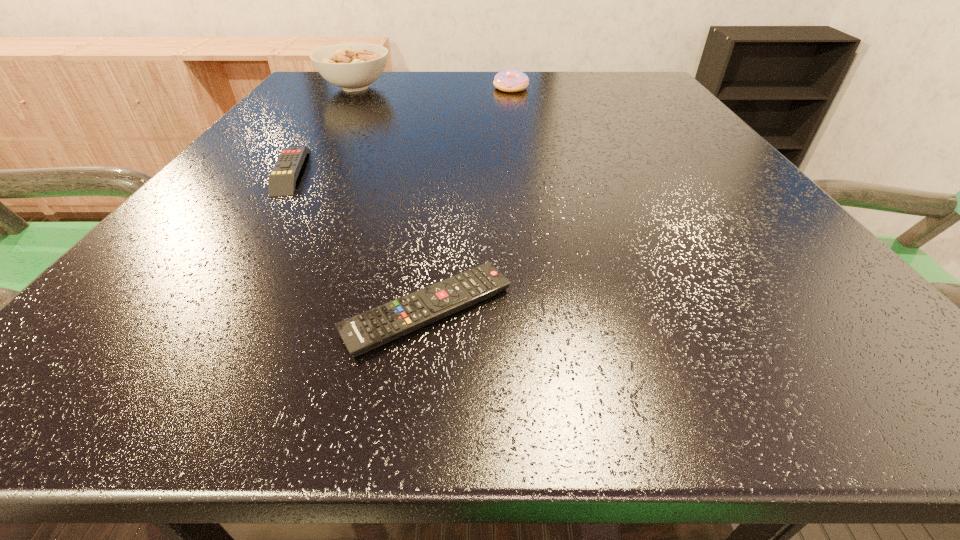
You are a GUI agent. You are given a task and a screenshot of the screen. Output one action in this format:
    pyautogui.click(x=<x>, y=<y>)
    Task: Click on the stew positioned at the far edge
    
    Given the screenshot: What is the action you would take?
    pyautogui.click(x=353, y=66)

This screenshot has width=960, height=540. In order to click on doughnut that is at the far edge in this screenshot , I will do `click(507, 80)`.

You are a GUI agent. You are given a task and a screenshot of the screen. Output one action in this format:
    pyautogui.click(x=<x>, y=<y>)
    Task: Click on the object that is positioned at the near edge
    The height and width of the screenshot is (540, 960).
    Given the screenshot: What is the action you would take?
    pyautogui.click(x=366, y=331)

At what (x,y) coordinates should I click in order to perform the action: click on stew located in the left edge section of the desktop. Please return your answer as a coordinate pair (x, y). This screenshot has height=540, width=960. Looking at the image, I should click on (353, 66).

Identify the location of remote control positioned at the left edge. (282, 180).

The height and width of the screenshot is (540, 960). Identify the location of object present at the far left corner. (353, 66).

The width and height of the screenshot is (960, 540). In order to click on vacant space at the far edge of the desktop in this screenshot , I will do `click(581, 86)`.

Where is `blank space at the near edge of the desktop`? blank space at the near edge of the desktop is located at coordinates (606, 327).

In the image, there is a desktop. Identify the location of free space at the left edge. This screenshot has height=540, width=960. (204, 249).

Locate an element on the screen. Image resolution: width=960 pixels, height=540 pixels. free location at the right edge is located at coordinates (704, 160).